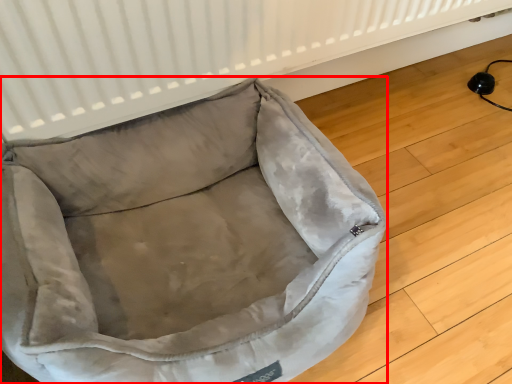
Question: From the image's perspective, where is dog bed (annotated by the red box) located in relation to radiator in the image?

Choices:
 (A) above
 (B) below

Answer: (B)